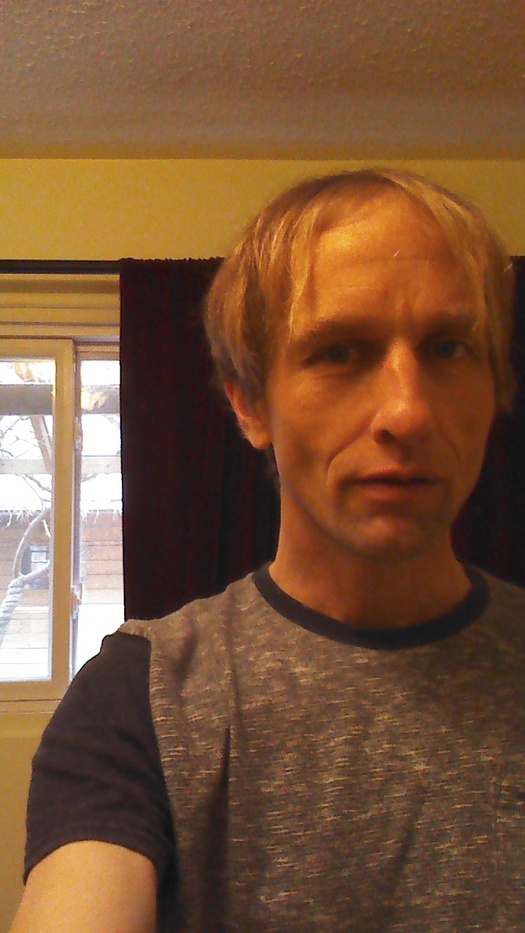
Identify the location of black curtain. The image size is (525, 933). (142, 380).